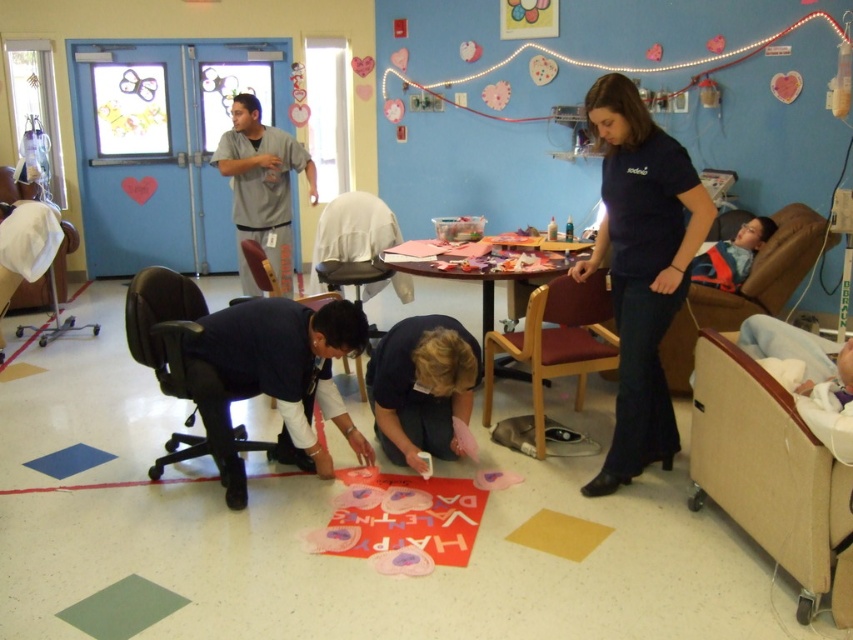
You are a patient in the hospital and need to move from the beige fabric hospital bed at lower right to the wooden armchair at center. Which direction should you move to reach it?

The beige fabric hospital bed at lower right is located below the wooden armchair at center, so you should move upward to reach the wooden armchair at center.

You are a patient in the hospital room and need to reach the wooden armchair at center from the beige fabric hospital bed at lower right. Can you walk directly to it without needing to go around any obstacles?

The beige fabric hospital bed at lower right is taller than wooden armchair at center, but there is no mention of obstacles between them. Therefore, you can walk directly to the wooden armchair at center.

You are a patient in the hospital who needs to reach the orange safety vest at right to grab a medical form. However, there is a wooden table at center blocking your path. Can you walk around the table to reach the vest without moving it?

The wooden table at center is in front of the orange safety vest at right, so you can walk around the table to reach the vest without moving it since it is positioned in front of the vest, allowing a path around it.